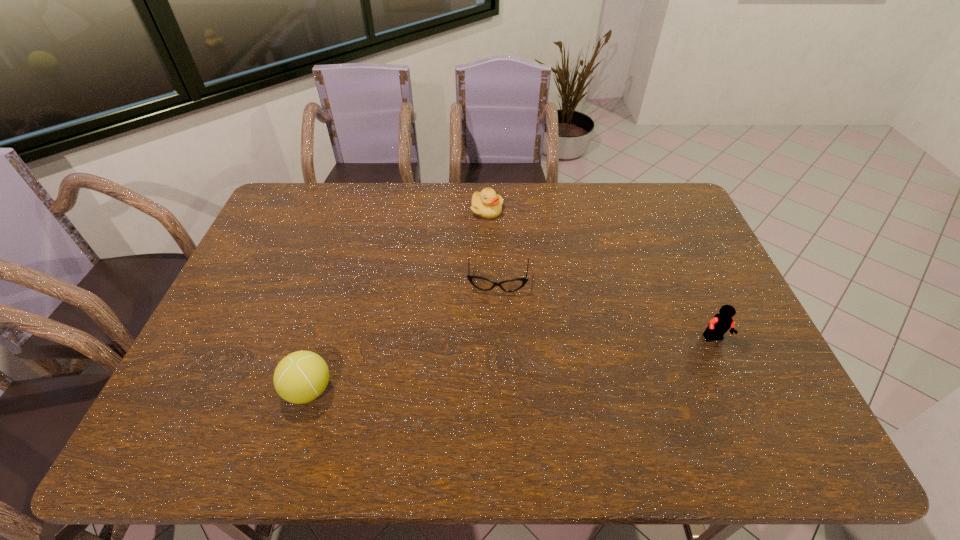
I want to click on vacant space on the desktop that is between the tennis ball and the rightmost object and is positioned on the front-facing side of the shortest object, so click(x=493, y=367).

Find the location of a particular element. The width and height of the screenshot is (960, 540). free spot on the desktop that is between the leftmost object and the rightmost object and is positioned on the beak of the farthest object is located at coordinates click(x=521, y=363).